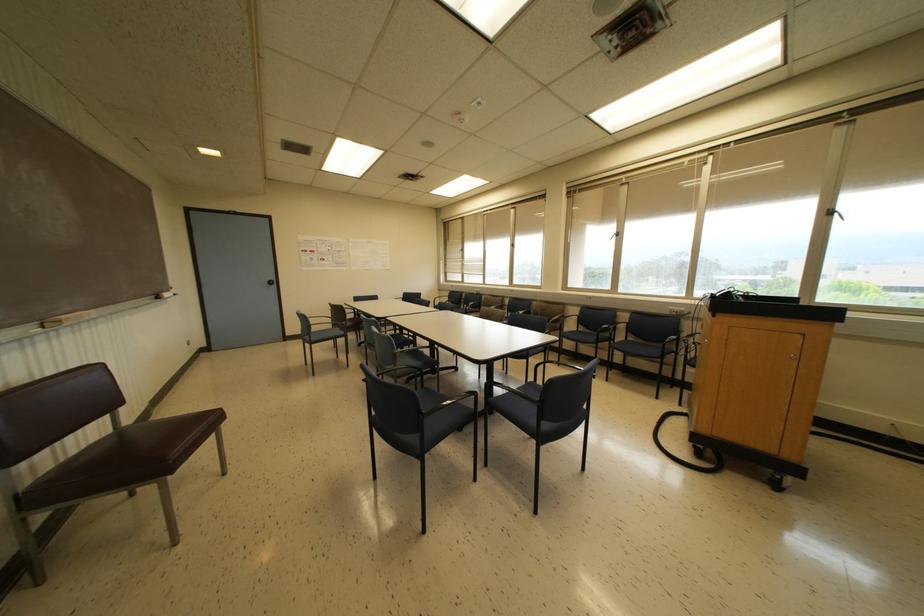
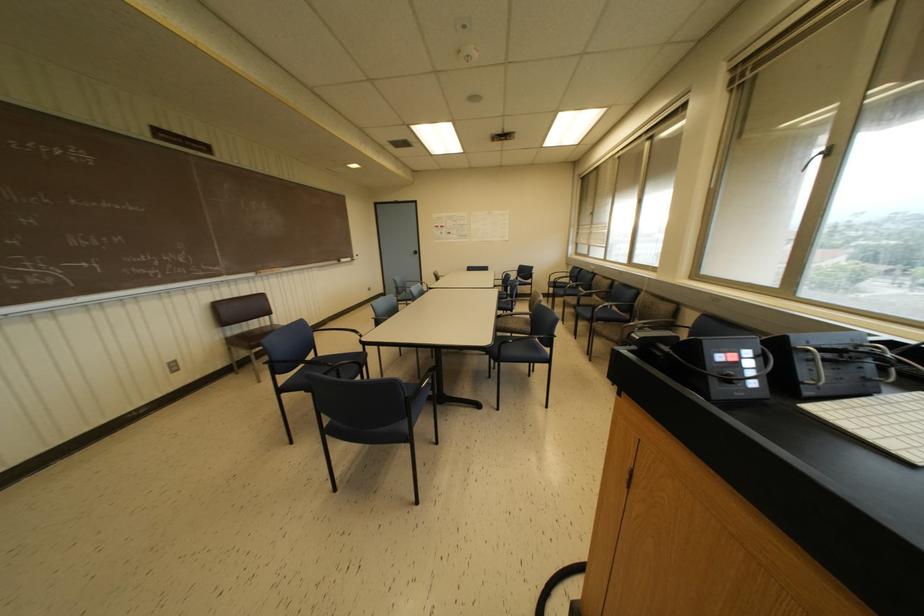
Where in the second image is the point corresponding to point (166, 294) from the first image?

(342, 259)